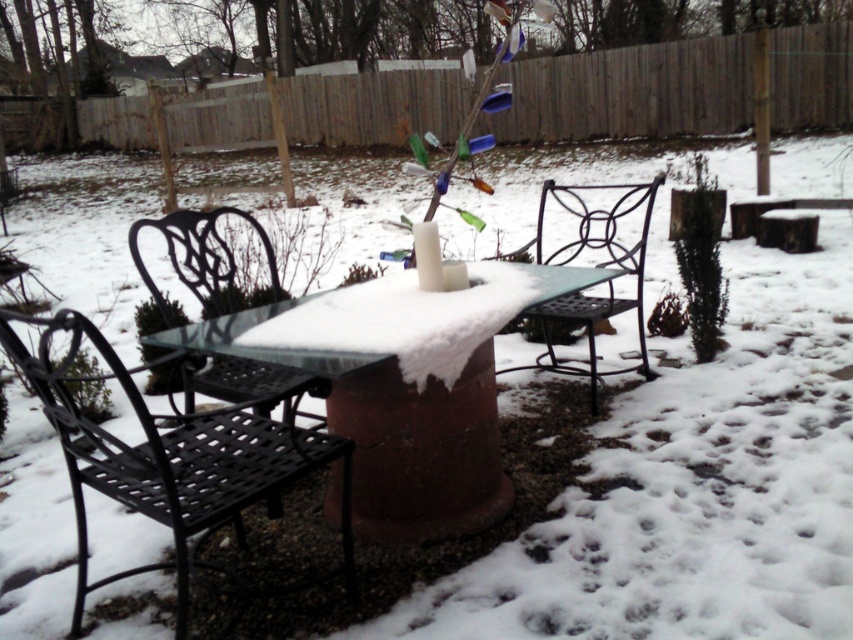
You are planning to sit on one of the chairs in the snowy patio. You want to choose the taller chair between the black wrought iron chair at left and the black wrought iron chair at center. Which one should you choose?

The black wrought iron chair at left has a greater height compared to the black wrought iron chair at center, so you should choose the black wrought iron chair at left.

You are planning to set up a small winter garden on the snowy patio. You have two black wrought iron chairs available. Which chair should you choose if you want a taller seat to avoid sitting too close to the snow? Please select between the black wrought iron chair at lower left and the black wrought iron chair at center.

The black wrought iron chair at center has a greater height compared to the black wrought iron chair at lower left, so you should choose the black wrought iron chair at center to avoid sitting too close to the snow.